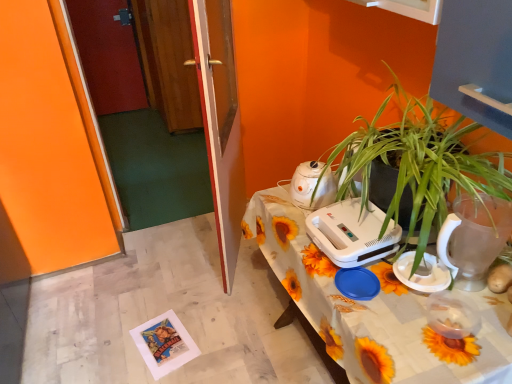
This screenshot has width=512, height=384. I want to click on blank space situated above white plastic appliance at upper right, which is the 3th appliance in front-to-back order (from a real-world perspective), so click(356, 219).